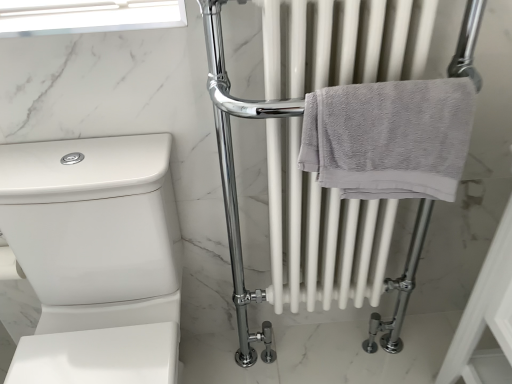
Describe the element at coordinates (389, 137) in the screenshot. I see `gray cotton towel at center right` at that location.

What do you see at coordinates (87, 16) in the screenshot?
I see `transparent glass window screen at upper left` at bounding box center [87, 16].

Find the location of a particular element. This screenshot has width=512, height=384. white glossy toilet at lower left is located at coordinates (95, 257).

Locate an element on the screen. gray cotton towel at center right is located at coordinates (389, 137).

Does white glossy toilet at lower left appear on the right side of transparent glass window screen at upper left?

Yes.

Which of these two, white glossy toilet at lower left or transparent glass window screen at upper left, stands taller?

With more height is white glossy toilet at lower left.

Which of these two, white glossy toilet at lower left or transparent glass window screen at upper left, is thinner?

With smaller width is transparent glass window screen at upper left.

In terms of size, does white glossy toilet at lower left appear bigger or smaller than transparent glass window screen at upper left?

Considering their sizes, white glossy toilet at lower left takes up more space than transparent glass window screen at upper left.

Is point (380, 182) less distant than point (44, 28)?

Yes.

From a real-world perspective, does gray cotton towel at center right sit lower than transparent glass window screen at upper left?

Correct, in the physical world, gray cotton towel at center right is lower than transparent glass window screen at upper left.

This screenshot has width=512, height=384. Find the location of `towel lying on the right of transparent glass window screen at upper left`. towel lying on the right of transparent glass window screen at upper left is located at coordinates (389, 137).

Measure the distance from gray cotton towel at center right to transparent glass window screen at upper left.

A distance of 18.76 inches exists between gray cotton towel at center right and transparent glass window screen at upper left.

From a real-world perspective, is gray cotton towel at center right above or below white glossy toilet at lower left?

In terms of real-world spatial position, gray cotton towel at center right is above white glossy toilet at lower left.

Is white glossy toilet at lower left a part of gray cotton towel at center right?

That's incorrect, white glossy toilet at lower left is not inside gray cotton towel at center right.

Looking at this image, considering the sizes of objects gray cotton towel at center right and white glossy toilet at lower left in the image provided, who is taller, gray cotton towel at center right or white glossy toilet at lower left?

With more height is white glossy toilet at lower left.

From the image's perspective, which one is positioned higher, gray cotton towel at center right or white glossy toilet at lower left?

gray cotton towel at center right, from the image's perspective.

Which object is closer to the camera, transparent glass window screen at upper left or white glossy toilet at lower left?

white glossy toilet at lower left is closer to the camera.

Consider the image. Considering the sizes of objects transparent glass window screen at upper left and white glossy toilet at lower left in the image provided, who is taller, transparent glass window screen at upper left or white glossy toilet at lower left?

white glossy toilet at lower left is taller.

Where is `window screen on the left of white glossy toilet at lower left`? The height and width of the screenshot is (384, 512). window screen on the left of white glossy toilet at lower left is located at coordinates (x=87, y=16).

Which of these two, transparent glass window screen at upper left or white glossy toilet at lower left, is bigger?

With larger size is white glossy toilet at lower left.

Which is closer, (73, 336) or (381, 179)?

The point (381, 179) is closer.

Looking at their sizes, would you say white glossy toilet at lower left is wider or thinner than gray cotton towel at center right?

In the image, white glossy toilet at lower left appears to be wider than gray cotton towel at center right.

What's the angular difference between white glossy toilet at lower left and gray cotton towel at center right's facing directions?

0.00188 degrees separate the facing orientations of white glossy toilet at lower left and gray cotton towel at center right.

Can you confirm if white glossy toilet at lower left is smaller than gray cotton towel at center right?

Actually, white glossy toilet at lower left might be larger than gray cotton towel at center right.

Relative to gray cotton towel at center right, is transparent glass window screen at upper left in front or behind?

Visually, transparent glass window screen at upper left is located behind gray cotton towel at center right.

Is transparent glass window screen at upper left bigger than gray cotton towel at center right?

No, transparent glass window screen at upper left is not bigger than gray cotton towel at center right.

How different are the orientations of transparent glass window screen at upper left and gray cotton towel at center right in degrees?

The facing directions of transparent glass window screen at upper left and gray cotton towel at center right are 0.477 degrees apart.

Is gray cotton towel at center right completely or partially inside transparent glass window screen at upper left?

No.

Image resolution: width=512 pixels, height=384 pixels. I want to click on toilet below the transparent glass window screen at upper left (from a real-world perspective), so click(95, 257).

At what (x,y) coordinates should I click in order to perform the action: click on towel that is in front of the transparent glass window screen at upper left. Please return your answer as a coordinate pair (x, y). The width and height of the screenshot is (512, 384). Looking at the image, I should click on (389, 137).

Based on the photo, based on their spatial positions, is white glossy toilet at lower left or transparent glass window screen at upper left closer to gray cotton towel at center right?

transparent glass window screen at upper left is positioned closer to the anchor gray cotton towel at center right.

Considering their positions, is gray cotton towel at center right positioned further to white glossy toilet at lower left than transparent glass window screen at upper left?

Based on the image, gray cotton towel at center right appears to be further to white glossy toilet at lower left.

From the picture: From the image, which object appears to be farther from transparent glass window screen at upper left, gray cotton towel at center right or white glossy toilet at lower left?

gray cotton towel at center right is positioned further to the anchor transparent glass window screen at upper left.

Considering their positions, is transparent glass window screen at upper left positioned further to white glossy toilet at lower left than gray cotton towel at center right?

Among the two, gray cotton towel at center right is located further to white glossy toilet at lower left.

Which object lies further to the anchor point gray cotton towel at center right, transparent glass window screen at upper left or white glossy toilet at lower left?

white glossy toilet at lower left lies further to gray cotton towel at center right than the other object.

When comparing their distances from transparent glass window screen at upper left, does white glossy toilet at lower left or gray cotton towel at center right seem closer?

Based on the image, white glossy toilet at lower left appears to be nearer to transparent glass window screen at upper left.

Identify the location of towel that lies between transparent glass window screen at upper left and white glossy toilet at lower left from top to bottom. This screenshot has height=384, width=512. (389, 137).